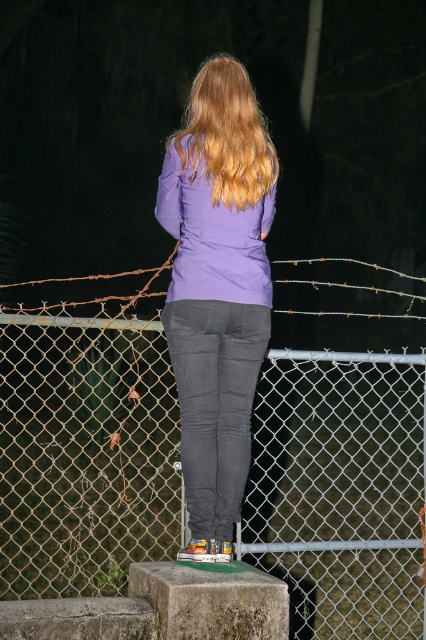
Question: Observing the image, what is the correct spatial positioning of purple matte sweatshirt at center in reference to golden wavy hair at back?

Choices:
 (A) right
 (B) left

Answer: (B)

Question: Where is purple matte jacket at center located in relation to purple matte sweatshirt at center in the image?

Choices:
 (A) above
 (B) below

Answer: (B)

Question: Which point is farther to the camera?

Choices:
 (A) (189, 483)
 (B) (210, 124)
 (C) (195, 282)

Answer: (B)

Question: Which object is the farthest from the wire mesh fence at center?

Choices:
 (A) purple matte sweatshirt at center
 (B) purple matte jacket at center
 (C) golden wavy hair at back

Answer: (B)

Question: Which object appears closest to the camera in this image?

Choices:
 (A) purple matte sweatshirt at center
 (B) wire mesh fence at center

Answer: (A)

Question: Is purple matte jacket at center in front of golden wavy hair at back?

Choices:
 (A) yes
 (B) no

Answer: (A)